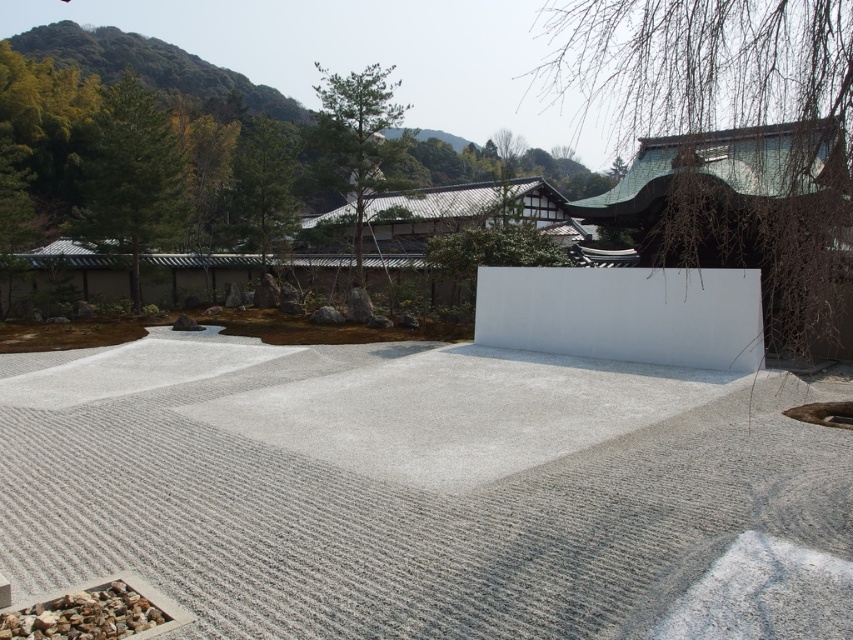
You are a visitor in the Japanese garden and notice two elements in the upper part of the scene. The bare branches at upper right and the green textured tree at upper center. Which one appears higher in the image?

The bare branches at upper right is positioned over the green textured tree at upper center, so it appears higher in the image.

You are a visitor in the Japanese garden and want to take a photo of the green textured tree at upper center without the gray gravel at lower left appearing in the background. Is this possible based on their positions?

The green textured tree at upper center is further to the viewer than the gray gravel at lower left, so you can position yourself closer to the tree and focus on it while the gravel is behind, making it possible to avoid the gravel in the background.

You are designing a garden pathway and want to place a decorative rock on top of the white smooth cement at center. Can the gray gravel at lower left be used as a base for this rock to ensure stability?

The white smooth cement at center is taller than gray gravel at lower left. Therefore, placing the gray gravel at lower left on top of the white smooth cement at center would not be stable since the gravel is lower in height. Instead, the rock should be placed directly on the white smooth cement at center for stability.